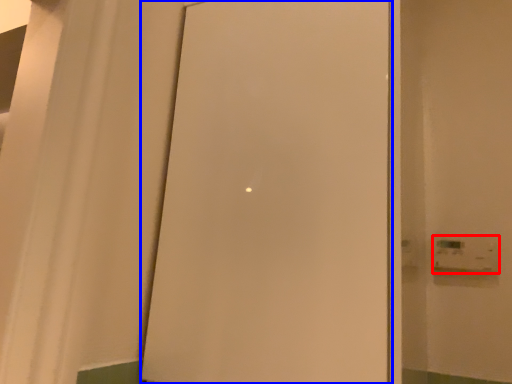
Question: Which point is closer to the camera, light switch (highlighted by a red box) or door (highlighted by a blue box)?

Choices:
 (A) light switch
 (B) door

Answer: (B)